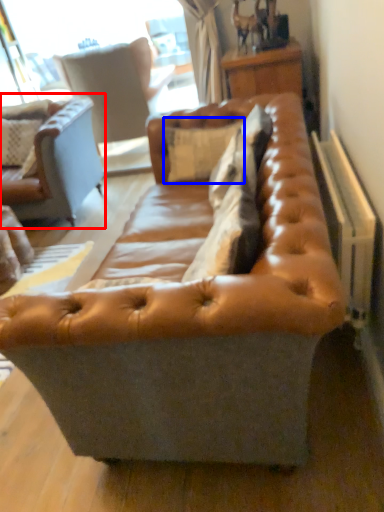
Question: Which object appears closest to the camera in this image, studio couch (highlighted by a red box) or pillow (highlighted by a blue box)?

Choices:
 (A) studio couch
 (B) pillow

Answer: (B)